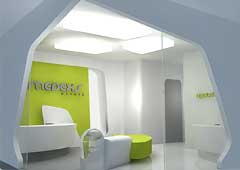
Image resolution: width=240 pixels, height=170 pixels. I want to click on glass panel, so tap(175, 154).